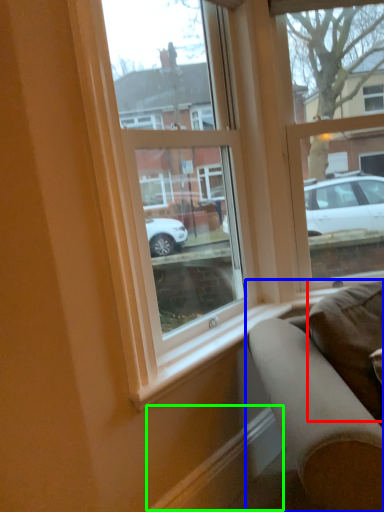
Question: Considering the real-world distances, which object is closest to pillow (highlighted by a red box)? studio couch (highlighted by a blue box) or curb (highlighted by a green box).

Choices:
 (A) studio couch
 (B) curb

Answer: (A)